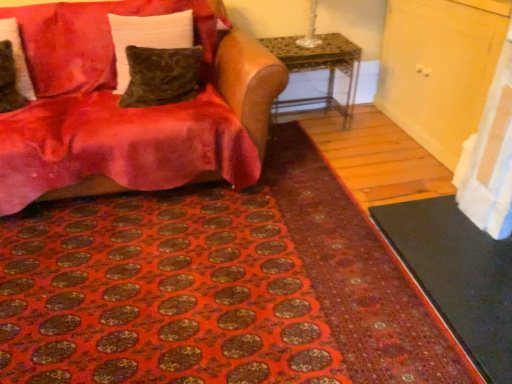
Question: Considering the relative sizes of velvet red couch at upper left and black rubber doormat at lower right in the image provided, is velvet red couch at upper left taller than black rubber doormat at lower right?

Choices:
 (A) no
 (B) yes

Answer: (B)

Question: Can black rubber doormat at lower right be found inside velvet red couch at upper left?

Choices:
 (A) no
 (B) yes

Answer: (A)

Question: Is velvet red couch at upper left completely or partially outside of black rubber doormat at lower right?

Choices:
 (A) no
 (B) yes

Answer: (B)

Question: Is velvet red couch at upper left next to black rubber doormat at lower right?

Choices:
 (A) yes
 (B) no

Answer: (B)

Question: Are velvet red couch at upper left and black rubber doormat at lower right far apart?

Choices:
 (A) no
 (B) yes

Answer: (B)

Question: Does velvet red couch at upper left turn towards black rubber doormat at lower right?

Choices:
 (A) yes
 (B) no

Answer: (B)

Question: Is velvet red couch at upper left facing away from patterned carpet at lower center?

Choices:
 (A) yes
 (B) no

Answer: (B)

Question: Considering the relative sizes of velvet red couch at upper left and patterned carpet at lower center in the image provided, is velvet red couch at upper left bigger than patterned carpet at lower center?

Choices:
 (A) yes
 (B) no

Answer: (A)

Question: Does velvet red couch at upper left appear on the right side of patterned carpet at lower center?

Choices:
 (A) no
 (B) yes

Answer: (A)

Question: From the image's perspective, is velvet red couch at upper left on top of patterned carpet at lower center?

Choices:
 (A) yes
 (B) no

Answer: (A)

Question: Considering the relative sizes of velvet red couch at upper left and patterned carpet at lower center in the image provided, is velvet red couch at upper left thinner than patterned carpet at lower center?

Choices:
 (A) no
 (B) yes

Answer: (B)

Question: Would you say velvet red couch at upper left is outside patterned carpet at lower center?

Choices:
 (A) no
 (B) yes

Answer: (B)

Question: Considering the relative positions of black rubber doormat at lower right and velvet red couch at upper left in the image provided, is black rubber doormat at lower right to the left of velvet red couch at upper left from the viewer's perspective?

Choices:
 (A) yes
 (B) no

Answer: (B)